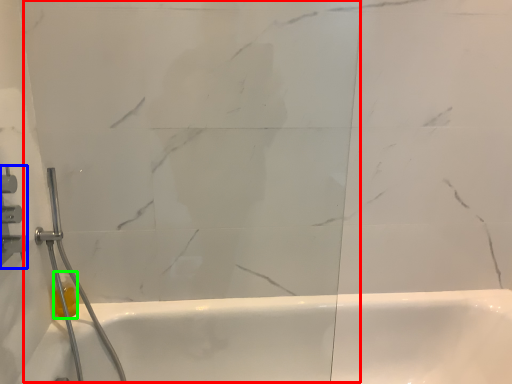
Question: Which is farther away from glass door (highlighted by a red box)? shower (highlighted by a blue box) or toiletry (highlighted by a green box)?

Choices:
 (A) shower
 (B) toiletry

Answer: (B)